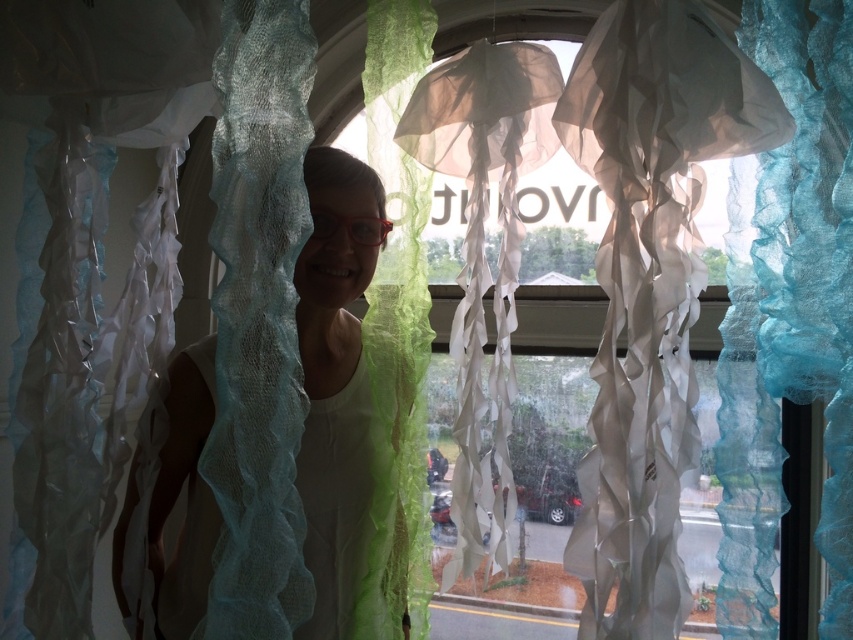
Which is more to the left, white sheer fabric at center or red translucent goggles at center?

white sheer fabric at center

This screenshot has width=853, height=640. I want to click on white sheer fabric at center, so click(331, 413).

The height and width of the screenshot is (640, 853). What are the coordinates of `white sheer fabric at center` in the screenshot? It's located at (331, 413).